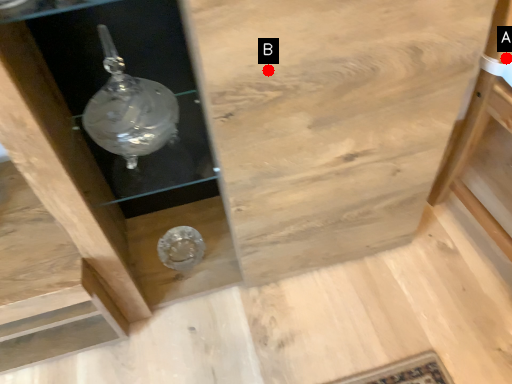
Question: Two points are circled on the image, labeled by A and B beside each circle. Which point is farther to the camera?

Choices:
 (A) A is further
 (B) B is further

Answer: (A)